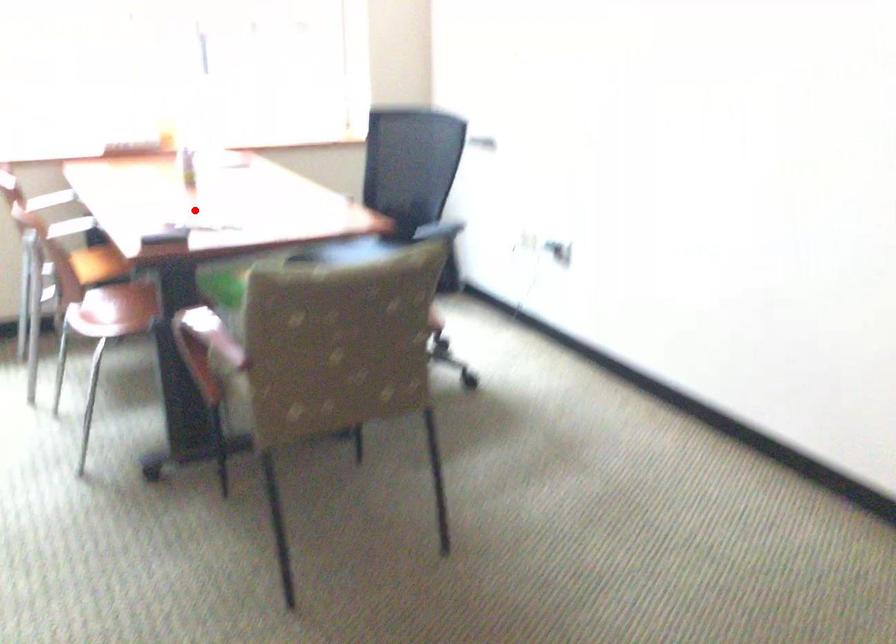
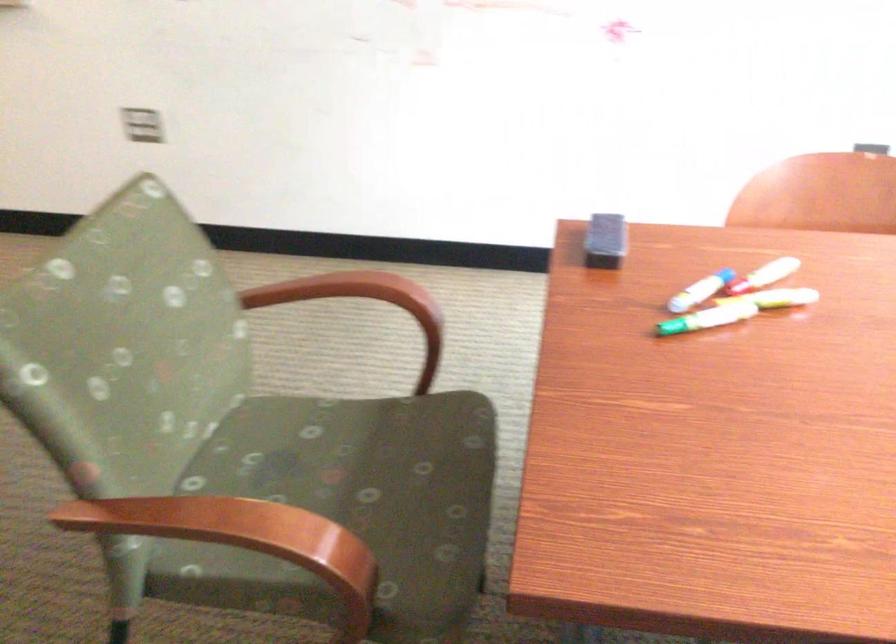
Question: I am providing you with two images of the same scene from different viewpoints. Image1 has a red point marked. In image2, the corresponding 3D location appears at what relative position? Reply with the corresponding letter.

Choices:
 (A) Closer
 (B) Farther

Answer: (A)